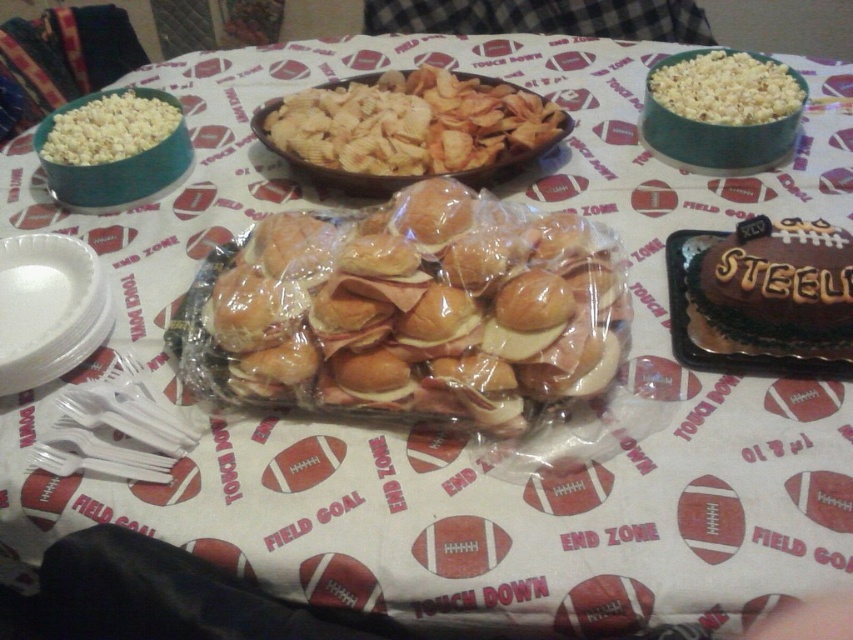
Question: Estimate the real-world distances between objects in this image. Which object is farther from the white popcorn at upper left?

Choices:
 (A) white popcorn at upper right
 (B) translucent plastic sandwiches at center
 (C) chocolatesmoothfootball-shaped cake at right

Answer: (C)

Question: Does chocolatesmoothfootball-shaped cake at right appear on the right side of white paper plate at left?

Choices:
 (A) yes
 (B) no

Answer: (A)

Question: Does chocolatesmoothfootball-shaped cake at right lie in front of white popcorn at upper right?

Choices:
 (A) no
 (B) yes

Answer: (B)

Question: Among these objects, which one is nearest to the camera?

Choices:
 (A) white popcorn at upper right
 (B) translucent plastic sandwiches at center

Answer: (B)

Question: Which object appears farthest from the camera in this image?

Choices:
 (A) brown crispy chips at center
 (B) white popcorn at upper right
 (C) chocolatesmoothfootball-shaped cake at right

Answer: (B)

Question: From the image, what is the correct spatial relationship of translucent plastic sandwiches at center in relation to chocolatesmoothfootball-shaped cake at right?

Choices:
 (A) right
 (B) left

Answer: (B)